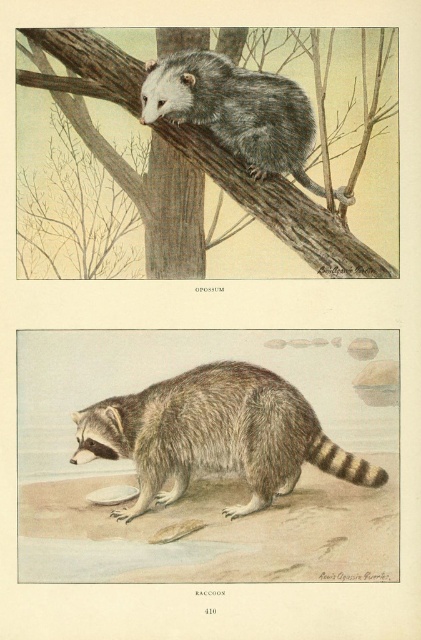
You are an observer looking at the top panel of the image. You notice two points marked in the scene. Which point is closer to you, point (x=93, y=45) or point (x=191, y=109)?

Point (x=93, y=45) is in front of point (x=191, y=109), so it is closer to you.

You are a bird flying between the brown fur raccoon at lower center and the gray furry opossum at upper center. Which animal will you reach first if you fly straight towards the closer one?

The brown fur raccoon at lower center is closer, so you will reach it first.

You are an animal tracker trying to locate the brown fur raccoon at lower center in the image. According to the coordinates provided, where should you focus your search?

The brown fur raccoon at lower center is located at coordinates point (215, 435).